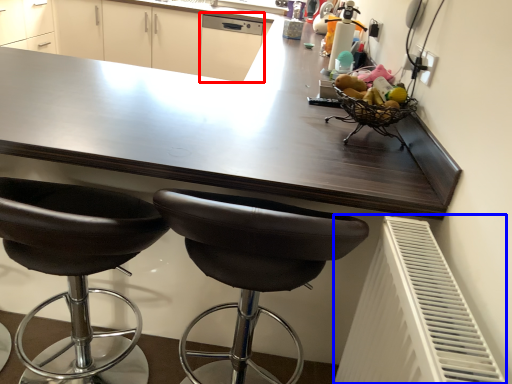
Question: Among these objects, which one is farthest to the camera, dish washer (highlighted by a red box) or radiator (highlighted by a blue box)?

Choices:
 (A) dish washer
 (B) radiator

Answer: (A)